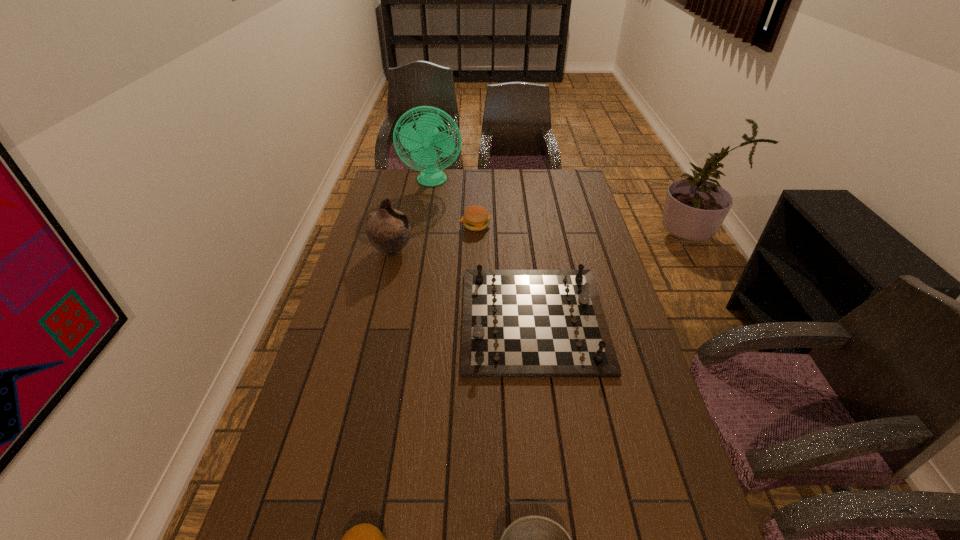
Image resolution: width=960 pixels, height=540 pixels. I want to click on free space at the right edge of the desktop, so click(576, 260).

At what (x,y) coordinates should I click in order to perform the action: click on vacant space at the far left corner of the desktop. Please return your answer as a coordinate pair (x, y). This screenshot has width=960, height=540. Looking at the image, I should click on (397, 190).

Locate an element on the screen. The width and height of the screenshot is (960, 540). empty space between the pottery and the tallest object is located at coordinates (412, 217).

Identify which object is the third nearest to the nearer hamburger. Please provide its 2D coordinates. Your answer should be formatted as a tuple, i.e. [(x, y)], where the tuple contains the x and y coordinates of a point satisfying the conditions above.

[(388, 230)]

In order to click on object that stands as the fifth closest to the second tallest object in this screenshot , I will do `click(534, 539)`.